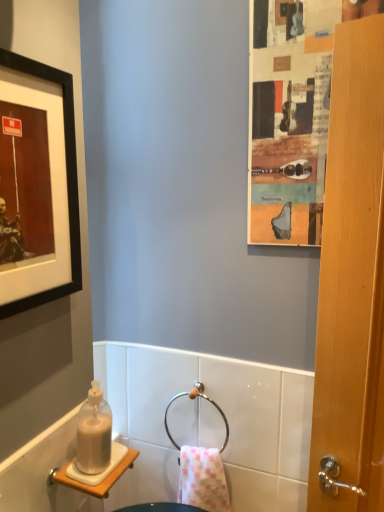
Question: Is pink checkered towel at center at the left side of black matte picture frame at upper left?

Choices:
 (A) yes
 (B) no

Answer: (B)

Question: From the image's perspective, would you say pink checkered towel at center is shown under black matte picture frame at upper left?

Choices:
 (A) no
 (B) yes

Answer: (B)

Question: Is pink checkered towel at center touching black matte picture frame at upper left?

Choices:
 (A) no
 (B) yes

Answer: (A)

Question: From a real-world perspective, is pink checkered towel at center below black matte picture frame at upper left?

Choices:
 (A) yes
 (B) no

Answer: (A)

Question: Is pink checkered towel at center outside black matte picture frame at upper left?

Choices:
 (A) yes
 (B) no

Answer: (A)

Question: Is pink checkered towel at center further to the viewer compared to black matte picture frame at upper left?

Choices:
 (A) yes
 (B) no

Answer: (A)

Question: Is wooden-framed collage at upper right completely or partially outside of translucent plastic bottle at lower left?

Choices:
 (A) yes
 (B) no

Answer: (A)

Question: Is wooden-framed collage at upper right thinner than translucent plastic bottle at lower left?

Choices:
 (A) yes
 (B) no

Answer: (A)

Question: Is wooden-framed collage at upper right at the left side of translucent plastic bottle at lower left?

Choices:
 (A) no
 (B) yes

Answer: (A)

Question: Is wooden-framed collage at upper right aimed at translucent plastic bottle at lower left?

Choices:
 (A) no
 (B) yes

Answer: (A)

Question: Is wooden-framed collage at upper right looking in the opposite direction of translucent plastic bottle at lower left?

Choices:
 (A) yes
 (B) no

Answer: (B)

Question: Is wooden-framed collage at upper right smaller than translucent plastic bottle at lower left?

Choices:
 (A) yes
 (B) no

Answer: (B)

Question: Is black matte picture frame at upper left positioned behind pink checkered towel at center?

Choices:
 (A) no
 (B) yes

Answer: (A)